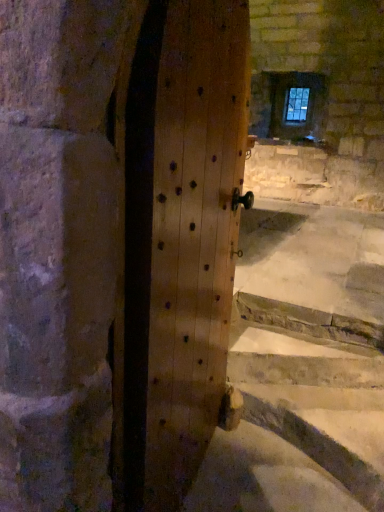
Question: Is point (135, 451) closer or farther from the camera than point (304, 90)?

Choices:
 (A) closer
 (B) farther

Answer: (A)

Question: Would you say natural wood door at center is inside or outside clear glass window at upper center?

Choices:
 (A) outside
 (B) inside

Answer: (A)

Question: From a real-world perspective, is natural wood door at center positioned above or below clear glass window at upper center?

Choices:
 (A) above
 (B) below

Answer: (B)

Question: Is clear glass window at upper center wider or thinner than natural wood door at center?

Choices:
 (A) thin
 (B) wide

Answer: (A)

Question: From the image's perspective, is clear glass window at upper center located above or below natural wood door at center?

Choices:
 (A) above
 (B) below

Answer: (A)

Question: Is clear glass window at upper center taller or shorter than natural wood door at center?

Choices:
 (A) tall
 (B) short

Answer: (B)

Question: Based on their positions, is clear glass window at upper center located to the left or right of natural wood door at center?

Choices:
 (A) right
 (B) left

Answer: (A)